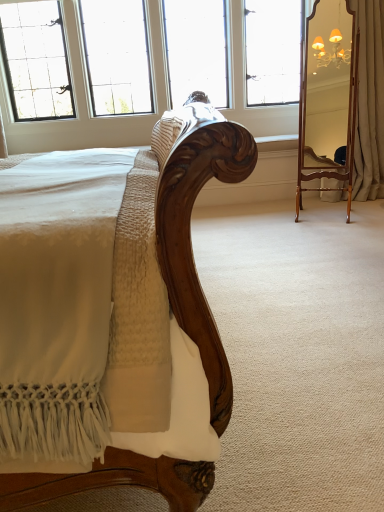
Question: Is point (6, 59) positioned closer to the camera than point (382, 83)?

Choices:
 (A) farther
 (B) closer

Answer: (A)

Question: Is clear glass window at upper center wider or thinner than beige fabric curtain at right?

Choices:
 (A) wide
 (B) thin

Answer: (A)

Question: Considering the real-world distances, which object is closest to the clear glass window at upper center?

Choices:
 (A) beige fabric curtain at right
 (B) wooden mirror at right

Answer: (B)

Question: Which is nearer to the wooden mirror at right?

Choices:
 (A) beige fabric curtain at right
 (B) clear glass window at upper center

Answer: (A)